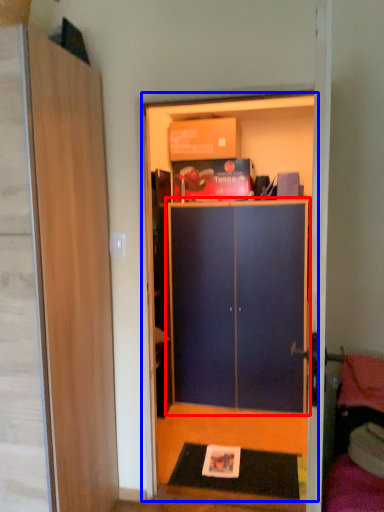
Question: Which object is closer to the camera taking this photo, cabinetry (highlighted by a red box) or dresser (highlighted by a blue box)?

Choices:
 (A) cabinetry
 (B) dresser

Answer: (B)